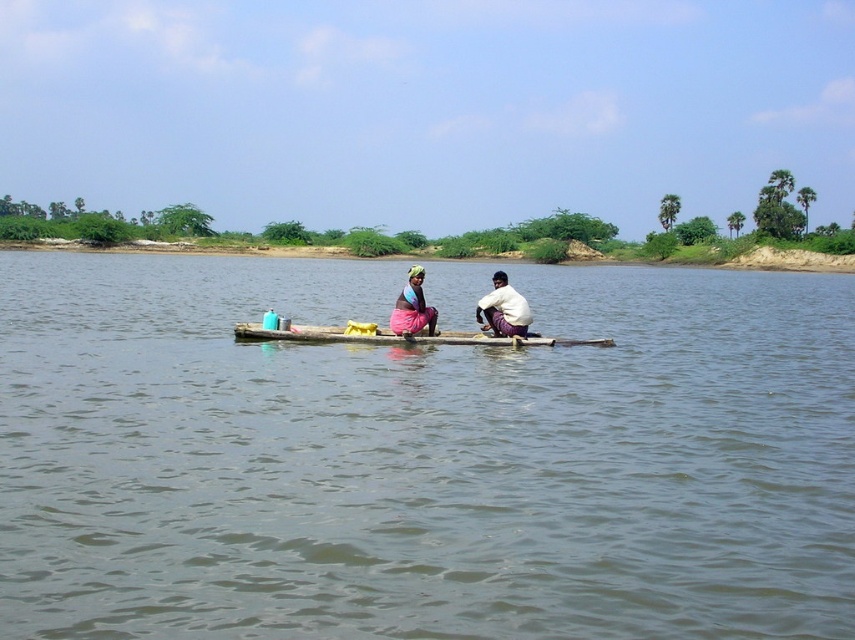
Question: Can you confirm if brown wooden raft at center is positioned below matte pink fabric at center?

Choices:
 (A) yes
 (B) no

Answer: (B)

Question: Does white cotton shirt at center appear under matte pink fabric at center?

Choices:
 (A) yes
 (B) no

Answer: (A)

Question: Does brown wooden raft at center lie in front of wooden log boat at center?

Choices:
 (A) no
 (B) yes

Answer: (B)

Question: Which of the following is the farthest from the observer?

Choices:
 (A) (528, 308)
 (B) (405, 323)
 (C) (239, 330)
 (D) (133, 324)

Answer: (D)

Question: Estimate the real-world distances between objects in this image. Which object is closer to the brown wooden raft at center?

Choices:
 (A) matte pink fabric at center
 (B) wooden log boat at center

Answer: (B)

Question: Which point is closer to the camera?

Choices:
 (A) brown wooden raft at center
 (B) matte pink fabric at center

Answer: (A)